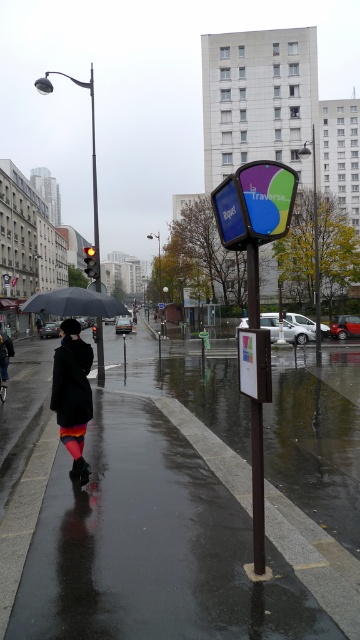
In the scene shown: You are standing at the point with coordinates point (56, 289) and want to walk to the point with coordinates point (119, 480). Which direction should you move in relative to the bus stop signpost?

You should move towards the direction of the bus stop signpost because point (119, 480) is in front of point (56, 289), meaning it is closer to the bus stop signpost.

Based on the scene description, where is the shiny asphalt pavement at center located in 2D coordinates?

The shiny asphalt pavement at center is located at the 2D coordinates of point [199,506].